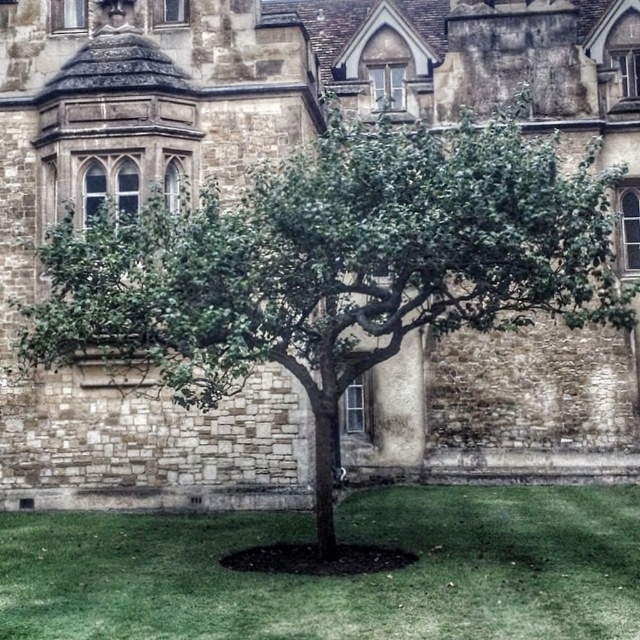
At what (x,y) coordinates should I click in order to perform the action: click on green leafy tree at center. Please return your answer as a coordinate pair (x, y). Image resolution: width=640 pixels, height=640 pixels. Looking at the image, I should click on (330, 269).